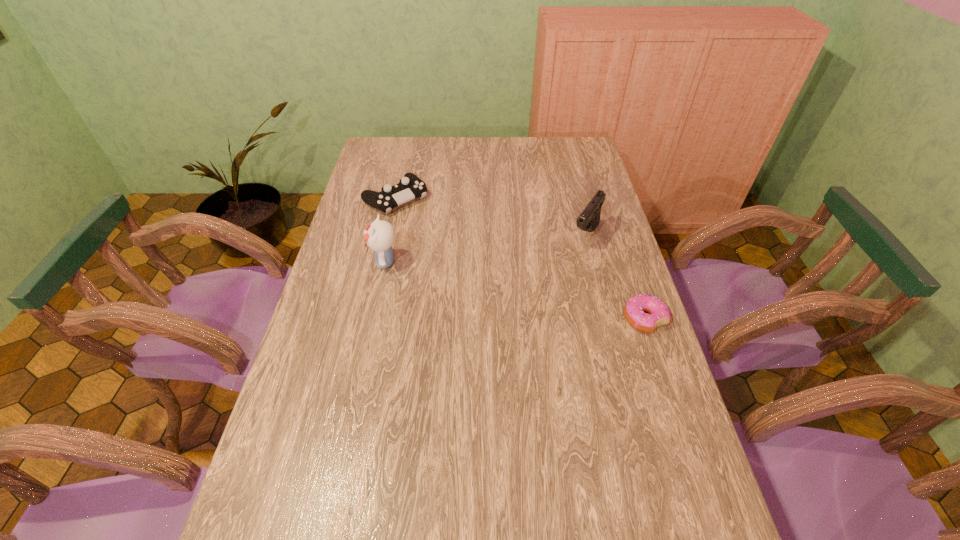
Locate an element on the screen. This screenshot has width=960, height=540. vacant space at the near edge of the desktop is located at coordinates (563, 523).

Where is `free space at the left edge of the desktop`? free space at the left edge of the desktop is located at coordinates (358, 288).

This screenshot has height=540, width=960. I want to click on vacant space at the right edge of the desktop, so click(x=663, y=402).

You are a GUI agent. You are given a task and a screenshot of the screen. Output one action in this format:
    pyautogui.click(x=<x>, y=<y>)
    Task: Click on the vacant space at the far left corner of the desktop
    
    Given the screenshot: What is the action you would take?
    pyautogui.click(x=392, y=155)

The image size is (960, 540). Identify the location of vacant space at the far right corner of the desktop. (573, 161).

In the image, there is a desktop. Identify the location of vacant region at the near right corner. The image size is (960, 540). (705, 520).

The width and height of the screenshot is (960, 540). Find the location of `unoccupied position between the third shortest object and the nearest object`. unoccupied position between the third shortest object and the nearest object is located at coordinates (615, 277).

Identify the location of free space between the second tallest object and the shortest object. (615, 277).

In order to click on free area in between the pistol and the nearest object in this screenshot , I will do `click(615, 277)`.

Locate an element on the screen. This screenshot has width=960, height=540. free space between the kitten and the pistol is located at coordinates (486, 248).